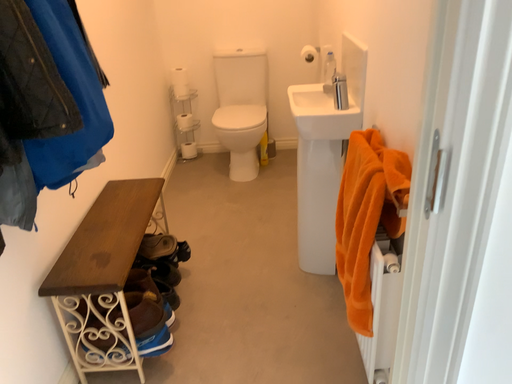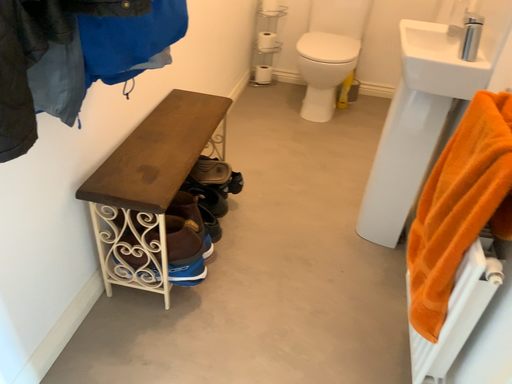
Question: Which way did the camera rotate in the video?

Choices:
 (A) rotated upward
 (B) rotated downward

Answer: (B)